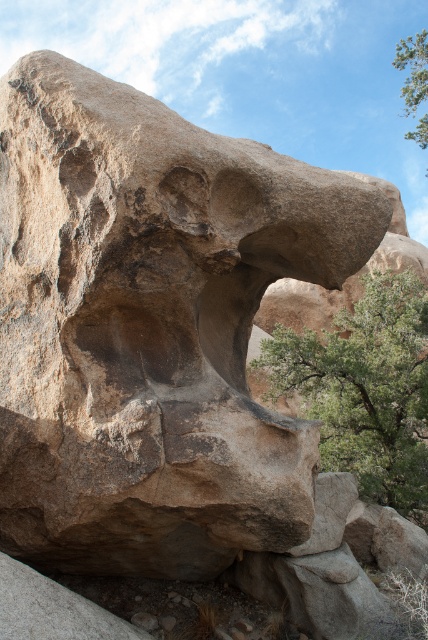
Question: Is the position of green leafy tree at center more distant than that of green leafy tree at upper right?

Choices:
 (A) yes
 (B) no

Answer: (B)

Question: From the image, what is the correct spatial relationship of green leafy tree at center in relation to green leafy tree at upper right?

Choices:
 (A) left
 (B) right

Answer: (A)

Question: Among these points, which one is farthest from the camera?

Choices:
 (A) (379, 301)
 (B) (413, 49)

Answer: (B)

Question: Which of the following is the farthest from the observer?

Choices:
 (A) green leafy tree at upper right
 (B) green leafy tree at center

Answer: (A)

Question: Is green leafy tree at center wider than green leafy tree at upper right?

Choices:
 (A) yes
 (B) no

Answer: (B)